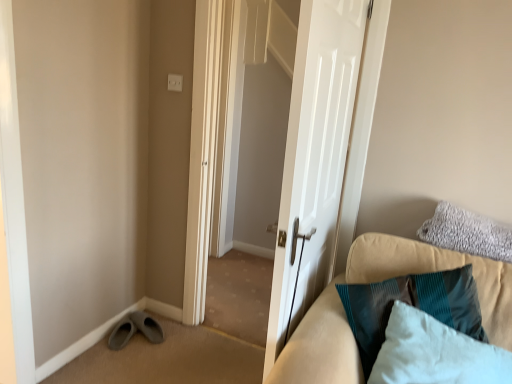
Question: Considering the relative sizes of white glossy door at center and teal fabric couch at right in the image provided, is white glossy door at center smaller than teal fabric couch at right?

Choices:
 (A) yes
 (B) no

Answer: (B)

Question: Is white glossy door at center completely or partially outside of teal fabric couch at right?

Choices:
 (A) yes
 (B) no

Answer: (A)

Question: Can you confirm if white glossy door at center is bigger than teal fabric couch at right?

Choices:
 (A) no
 (B) yes

Answer: (B)

Question: Is teal fabric couch at right at the back of white glossy door at center?

Choices:
 (A) no
 (B) yes

Answer: (A)

Question: Considering the relative positions of white glossy door at center and teal fabric couch at right in the image provided, is white glossy door at center behind teal fabric couch at right?

Choices:
 (A) no
 (B) yes

Answer: (B)

Question: Could you tell me if white glossy door at center is turned towards teal fabric couch at right?

Choices:
 (A) no
 (B) yes

Answer: (A)

Question: Considering the relative sizes of teal fabric couch at right and white glossy door at center in the image provided, is teal fabric couch at right bigger than white glossy door at center?

Choices:
 (A) yes
 (B) no

Answer: (B)

Question: Can you confirm if teal fabric couch at right is shorter than white glossy door at center?

Choices:
 (A) yes
 (B) no

Answer: (A)

Question: Does teal fabric couch at right come behind white glossy door at center?

Choices:
 (A) yes
 (B) no

Answer: (B)

Question: Can you confirm if teal fabric couch at right is smaller than white glossy door at center?

Choices:
 (A) yes
 (B) no

Answer: (A)

Question: From the image's perspective, is teal fabric couch at right on top of white glossy door at center?

Choices:
 (A) no
 (B) yes

Answer: (A)

Question: Is teal fabric couch at right outside white glossy door at center?

Choices:
 (A) yes
 (B) no

Answer: (A)

Question: Is gray fluffy pillow at upper right, placed as the 2th pillow when sorted from front to back, not inside teal fabric couch at right?

Choices:
 (A) yes
 (B) no

Answer: (A)